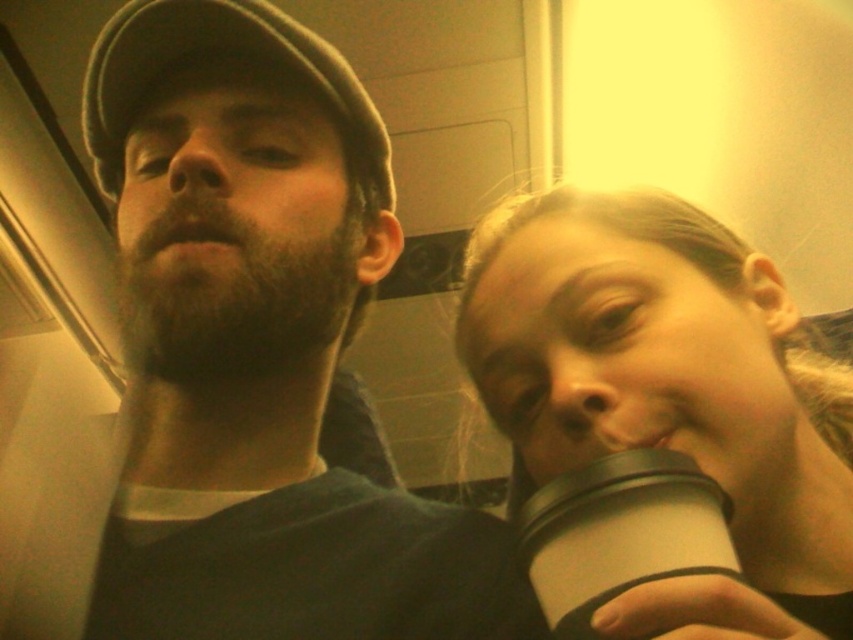
You are a photographer trying to capture a closeup shot of both the matte black cap at upper left and the white matte cup at lower right in this scene. Your camera has a focus range that can handle objects up to 15 cm in width. Can both objects fit within the focus range based on their widths?

The matte black cap at upper left might be wider than white matte cup at lower right, but since the maximum width of the cap isn generated, we cannot confirm if both would fit within the 15 cm focus range. Further measurement is needed.

You are a passenger on a train and want to place your white matte cup at right on the table in front of you. The table is located at point 0.5, 0.5. Can you reach the table from your current position?

The white matte cup at right is located at point (668, 392), which is farther from the table at (426, 320) than your current position. Therefore, you can reach the table.